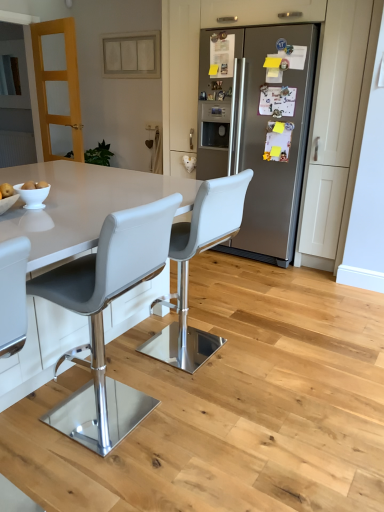
What are the coordinates of `free space to the back side of white leather stool at center, which is the 2th chair in front-to-back order` in the screenshot? It's located at (210, 316).